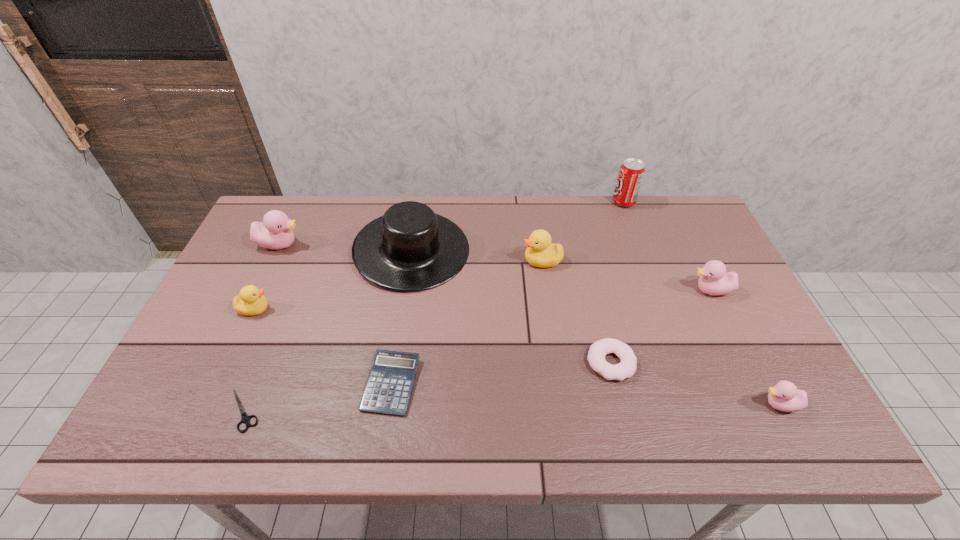
At what (x,y) coordinates should I click in order to perform the action: click on vacant space located 0.090m on the left of the seventh object from left to right. Please return your answer as a coordinate pair (x, y). The height and width of the screenshot is (540, 960). Looking at the image, I should click on (549, 362).

At what (x,y) coordinates should I click in order to perform the action: click on free space located 0.070m on the back of the calculator. Please return your answer as a coordinate pair (x, y). The image size is (960, 540). Looking at the image, I should click on [x=399, y=332].

The image size is (960, 540). In order to click on vacant space located on the back of the shortest object in this screenshot , I will do `click(259, 370)`.

I want to click on soda situated at the far edge, so click(x=631, y=172).

Locate an element on the screen. The image size is (960, 540). dress hat at the far edge is located at coordinates (410, 248).

What are the coordinates of `duckling that is positioned at the far edge` in the screenshot? It's located at (275, 232).

The image size is (960, 540). Identify the location of duckling present at the near edge. tap(784, 396).

Identify the location of calculator positioned at the near edge. (389, 386).

The image size is (960, 540). Find the location of `shears at the near edge`. shears at the near edge is located at coordinates (245, 418).

You are a GUI agent. You are given a task and a screenshot of the screen. Output one action in this format:
    pyautogui.click(x=<x>, y=<y>)
    Task: Click on the shears that is at the left edge
    This screenshot has height=540, width=960.
    Given the screenshot: What is the action you would take?
    pyautogui.click(x=245, y=418)